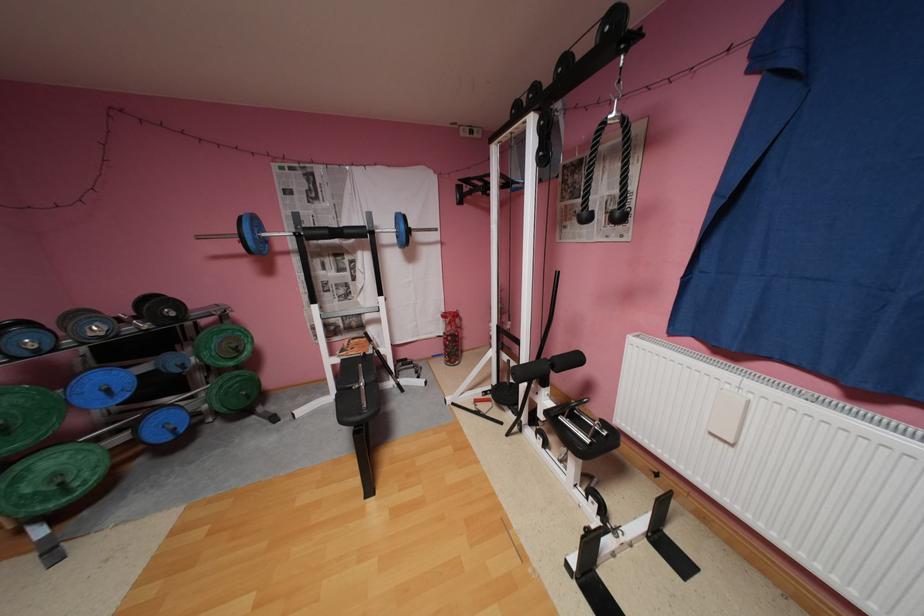
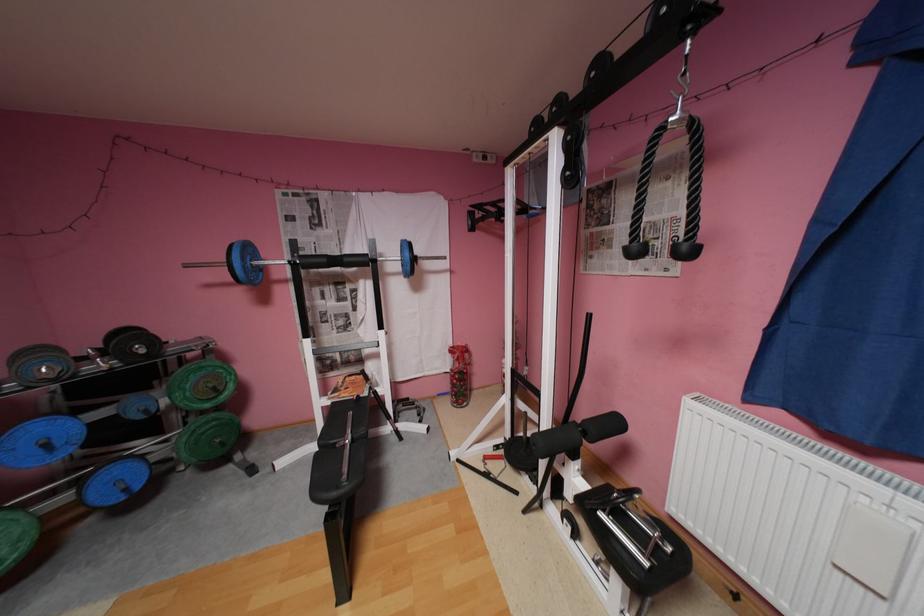
The point at (91, 314) is marked in the first image. Where is the corresponding point in the second image?

(49, 351)